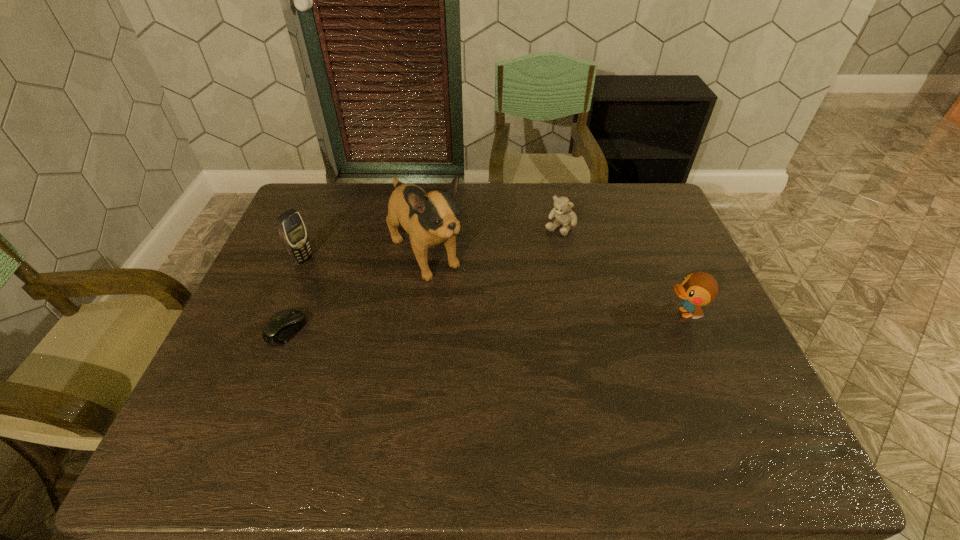
Where is `the shortest object`? the shortest object is located at coordinates (281, 327).

Where is `the rightmost object`? the rightmost object is located at coordinates 697,289.

Locate an element on the screen. the third shortest object is located at coordinates tap(697, 289).

I want to click on cellular telephone, so click(x=291, y=228).

In order to click on the tallest object in this screenshot , I will do `click(430, 219)`.

The height and width of the screenshot is (540, 960). What are the coordinates of `the third object from right to left` in the screenshot? It's located at (430, 219).

Identify the location of the fourth tallest object. (562, 212).

Locate an element on the screen. teddy bear is located at coordinates (562, 212).

In order to click on free region located on the right of the shortest object in this screenshot , I will do `click(376, 330)`.

Identify the location of vacant space located on the front-facing side of the rightmost object. Image resolution: width=960 pixels, height=540 pixels. (598, 313).